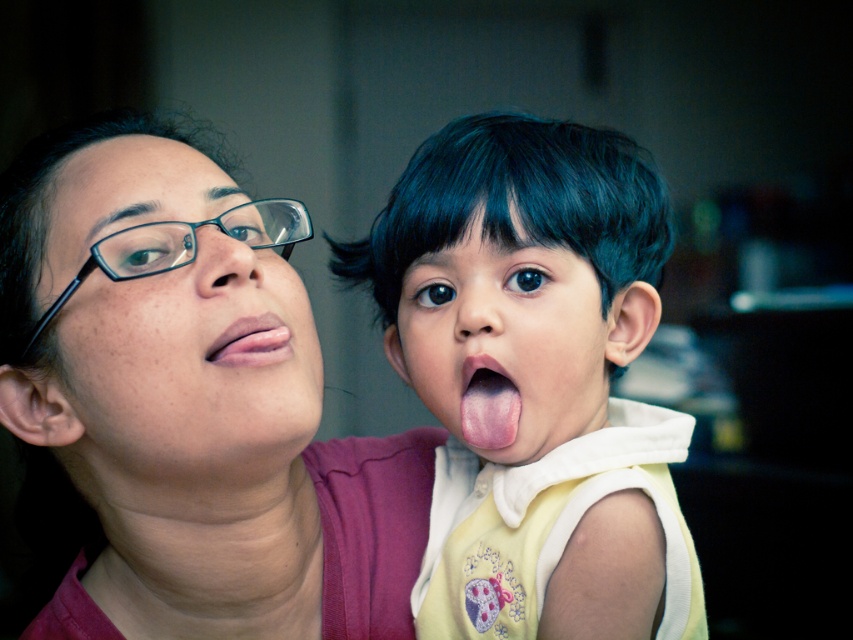
Looking at the scene described, can you determine the spatial relationship between the matte pink shirt at upper left and the smooth skin face at center?

The matte pink shirt at upper left is positioned to the left of the smooth skin face at center.

You are a photographer adjusting the camera focus. The matte pink shirt at upper left and the pink smooth tongue at center are both in the frame. Which object is closer to the camera lens?

The matte pink shirt at upper left is 21.68 centimeters from the pink smooth tongue at center. Since the distance between them is given, but we don not know their absolute distances from the camera, we cannot determine which is closer based solely on this information.

You are standing in the room and see two points in the image. The first point is at coordinate point (67,586) and the second point is at coordinate point (497,362). Which point is closer to you?

Point (497,362) is closer to you because it is in front of point (67,586).